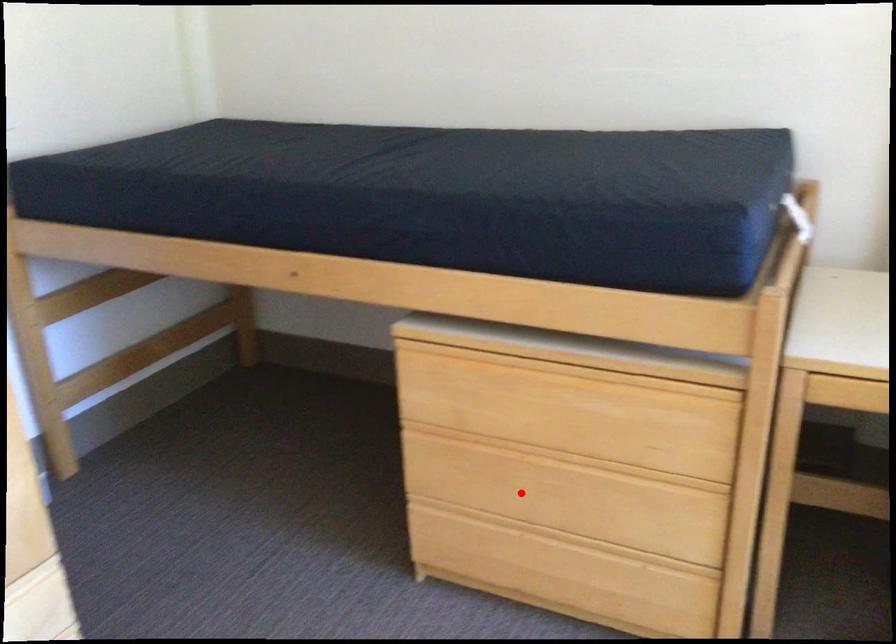
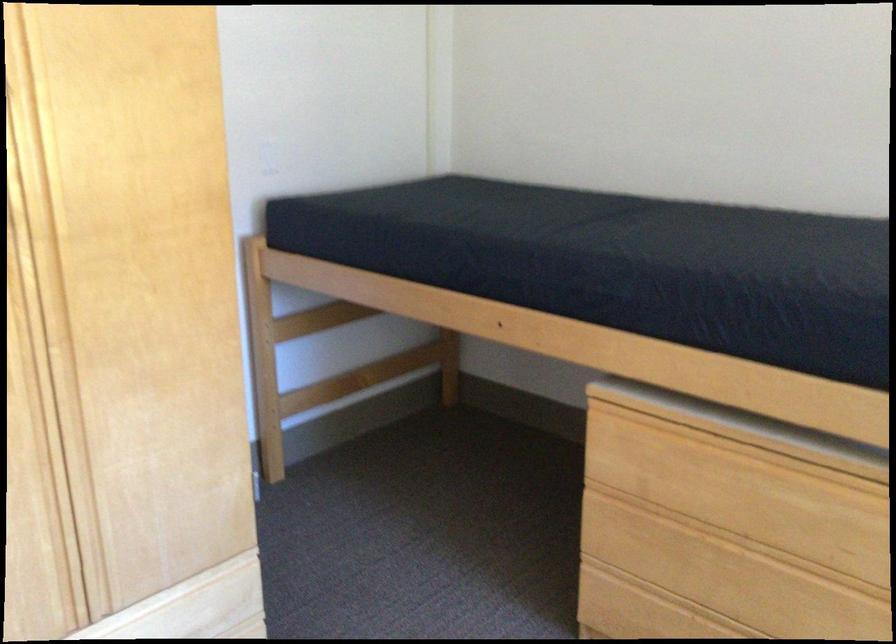
Find the pixel in the second image that matches the highlighted location in the first image.

(699, 574)